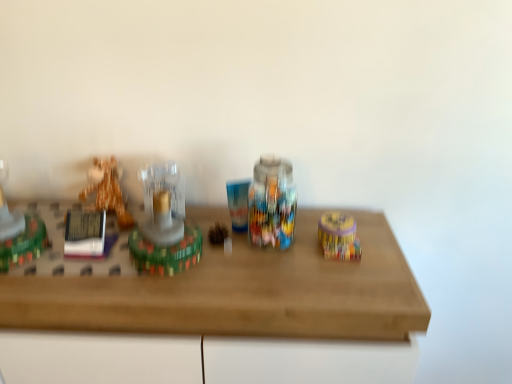
Question: Is matte yellow container at right, which ranks as the 4th toy in left-to-right order, turned away from translucent glass candle at center, positioned as the second toy in right-to-left order?

Choices:
 (A) no
 (B) yes

Answer: (A)

Question: Can you confirm if matte yellow container at right, which ranks as the 4th toy in left-to-right order, is positioned to the right of translucent glass candle at center, placed as the third toy when sorted from left to right?

Choices:
 (A) no
 (B) yes

Answer: (B)

Question: Considering the relative sizes of matte yellow container at right, which ranks as the 4th toy in left-to-right order, and translucent glass candle at center, positioned as the second toy in right-to-left order, in the image provided, is matte yellow container at right, which ranks as the 4th toy in left-to-right order, shorter than translucent glass candle at center, positioned as the second toy in right-to-left order,?

Choices:
 (A) yes
 (B) no

Answer: (A)

Question: Can you confirm if matte yellow container at right, which is counted as the first toy, starting from the right, is bigger than translucent glass candle at center, placed as the third toy when sorted from left to right?

Choices:
 (A) no
 (B) yes

Answer: (A)

Question: Is matte yellow container at right, which is counted as the first toy, starting from the right, thinner than translucent glass candle at center, placed as the third toy when sorted from left to right?

Choices:
 (A) no
 (B) yes

Answer: (B)

Question: Considering the relative positions of matte yellow container at right, which is counted as the first toy, starting from the right, and translucent glass candle at center, positioned as the second toy in right-to-left order, in the image provided, is matte yellow container at right, which is counted as the first toy, starting from the right, to the left of translucent glass candle at center, positioned as the second toy in right-to-left order, from the viewer's perspective?

Choices:
 (A) yes
 (B) no

Answer: (B)

Question: From the image's perspective, is wooden table at center located above matte yellow container at right, which is counted as the first toy, starting from the right?

Choices:
 (A) yes
 (B) no

Answer: (B)

Question: From the image's perspective, is wooden table at center under matte yellow container at right, which ranks as the 4th toy in left-to-right order?

Choices:
 (A) no
 (B) yes

Answer: (B)

Question: Does wooden table at center have a greater width compared to matte yellow container at right, which ranks as the 4th toy in left-to-right order?

Choices:
 (A) yes
 (B) no

Answer: (A)

Question: Is the depth of wooden table at center greater than that of matte yellow container at right, which is counted as the first toy, starting from the right?

Choices:
 (A) no
 (B) yes

Answer: (A)

Question: Is wooden table at center positioned with its back to matte yellow container at right, which is counted as the first toy, starting from the right?

Choices:
 (A) yes
 (B) no

Answer: (B)

Question: Is wooden table at center positioned beyond the bounds of matte yellow container at right, which ranks as the 4th toy in left-to-right order?

Choices:
 (A) no
 (B) yes

Answer: (B)

Question: Can you confirm if translucent glass candle at center, positioned as the second toy in right-to-left order, is positioned to the right of matte yellow container at right, which ranks as the 4th toy in left-to-right order?

Choices:
 (A) no
 (B) yes

Answer: (A)